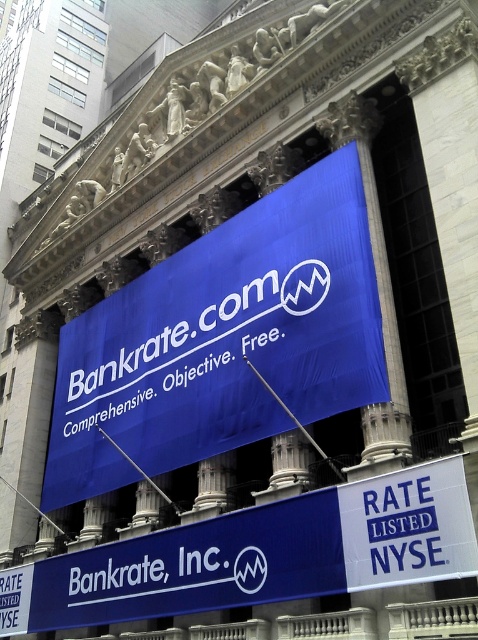
Can you confirm if blue fabric banner at center is bigger than blue matte banner at center?

Indeed, blue fabric banner at center has a larger size compared to blue matte banner at center.

Does blue fabric banner at center have a greater height compared to blue matte banner at center?

Correct, blue fabric banner at center is much taller as blue matte banner at center.

Which is in front, point (292, 381) or point (76, 625)?

Positioned in front is point (292, 381).

Find the location of `blue fabric banner at center`. blue fabric banner at center is located at coordinates tap(224, 339).